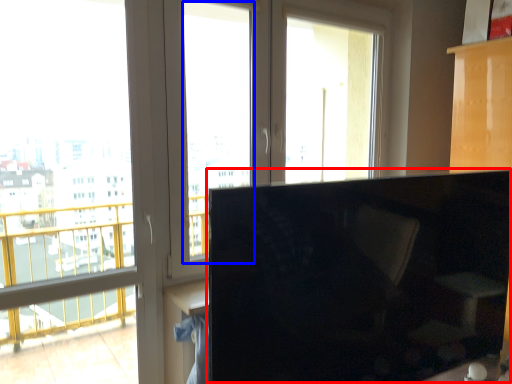
Question: Which object is further to the camera taking this photo, computer monitor (highlighted by a red box) or window screen (highlighted by a blue box)?

Choices:
 (A) computer monitor
 (B) window screen

Answer: (B)